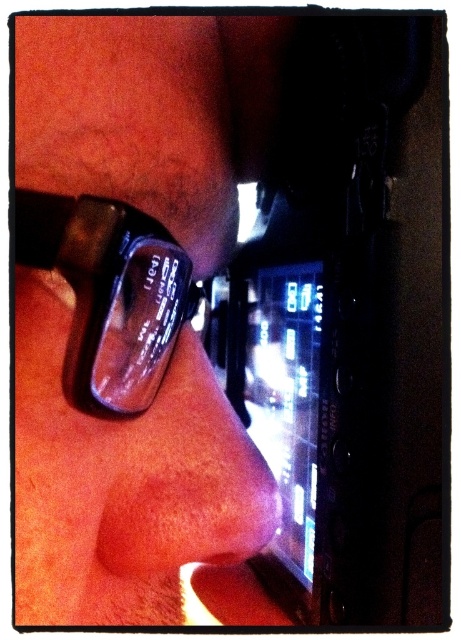
You are a jeweler examining a matte black watch at lower left and transparent plastic glasses at upper left. Which object has a wider surface area?

The matte black watch at lower left might be wider than transparent plastic glasses at upper left according to the description.

You are a photographer adjusting your camera settings. You notice the smooth skin nose at center and the transparent plastic glasses at upper left in your frame. Which object is positioned to the right side of the other?

The smooth skin nose at center is positioned to the right of the transparent plastic glasses at upper left.

Based on the photo, you are a photographer adjusting lighting for a portrait. You notice the smooth skin nose at center and the transparent plastic glasses at upper left in the frame. Which object is positioned lower in the image?

The smooth skin nose at center is located below transparent plastic glasses at upper left, so the smooth skin nose at center is positioned lower in the image.